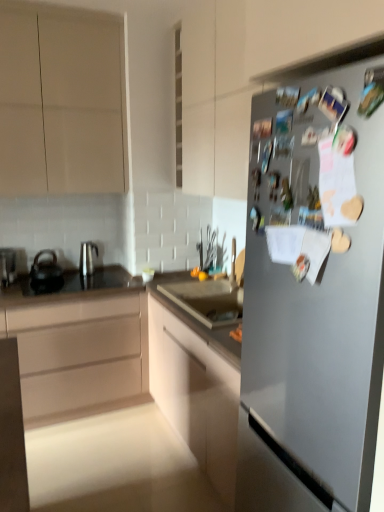
How much space does black matte tea pot at left, acting as the first tea pot starting from the left, occupy vertically?

black matte tea pot at left, acting as the first tea pot starting from the left, is 8.74 inches tall.

Describe the element at coordinates (60, 102) in the screenshot. I see `matte beige cabinet at upper left, positioned as the 1th cabinetry in top-to-bottom order` at that location.

Identify the location of satin silver kettle at left, which ranks as the second tea pot in left-to-right order. Image resolution: width=384 pixels, height=512 pixels. (87, 258).

Identify the location of matte white cabinet at center, the 1th cabinetry from the bottom. [x=126, y=362].

Where is `black matte tea pot at left, acting as the first tea pot starting from the left`? Image resolution: width=384 pixels, height=512 pixels. black matte tea pot at left, acting as the first tea pot starting from the left is located at coordinates (46, 273).

Does satin silver fridge at right appear on the right side of matte beige cabinet at upper left, which is the 3th cabinetry from bottom to top?

Yes.

In the scene shown: From the image's perspective, is satin silver fridge at right on top of matte beige cabinet at upper left, positioned as the 1th cabinetry in top-to-bottom order?

No, from the image's perspective, satin silver fridge at right is not on top of matte beige cabinet at upper left, positioned as the 1th cabinetry in top-to-bottom order.

Is satin silver fridge at right directly adjacent to matte beige cabinet at upper left, which is the 3th cabinetry from bottom to top?

There is a gap between satin silver fridge at right and matte beige cabinet at upper left, which is the 3th cabinetry from bottom to top.

Which is less distant, (351, 223) or (69, 109)?

The point (351, 223) is closer.

Considering their positions, is matte white cabinet at center, the third cabinetry positioned from the top, located in front of or behind metallic silver kettle at left?

Visually, matte white cabinet at center, the third cabinetry positioned from the top, is located in front of metallic silver kettle at left.

Which object is positioned more to the left, matte white cabinet at center, the third cabinetry positioned from the top, or metallic silver kettle at left?

metallic silver kettle at left.

Which of these two, matte white cabinet at center, the third cabinetry positioned from the top, or metallic silver kettle at left, is smaller?

Smaller between the two is metallic silver kettle at left.

In the image, is matte beige cabinet at upper left, which is the 3th cabinetry from bottom to top, on the left side or the right side of black matte tea pot at left, acting as the 2th tea pot starting from the right?

matte beige cabinet at upper left, which is the 3th cabinetry from bottom to top, is to the right of black matte tea pot at left, acting as the 2th tea pot starting from the right.

From the image's perspective, is matte beige cabinet at upper left, positioned as the 1th cabinetry in top-to-bottom order, above black matte tea pot at left, acting as the first tea pot starting from the left?

Indeed, from the image's perspective, matte beige cabinet at upper left, positioned as the 1th cabinetry in top-to-bottom order, is shown above black matte tea pot at left, acting as the first tea pot starting from the left.

Considering the relative sizes of matte beige cabinet at upper left, which is the 3th cabinetry from bottom to top, and black matte tea pot at left, acting as the first tea pot starting from the left, in the image provided, is matte beige cabinet at upper left, which is the 3th cabinetry from bottom to top, wider than black matte tea pot at left, acting as the first tea pot starting from the left,?

Correct, the width of matte beige cabinet at upper left, which is the 3th cabinetry from bottom to top, exceeds that of black matte tea pot at left, acting as the first tea pot starting from the left.

Which point is more distant from viewer, (7, 285) or (88, 242)?

The point (88, 242) is farther.

From a real-world perspective, relative to satin silver kettle at left, which is counted as the 1th tea pot, starting from the right, is metallic silver kettle at left vertically above or below?

In terms of real-world spatial position, metallic silver kettle at left is below satin silver kettle at left, which is counted as the 1th tea pot, starting from the right.

Which tea pot is the 2nd one when counting from the right side of the metallic silver kettle at left? Please provide its 2D coordinates.

[(87, 258)]

Considering the sizes of objects metallic silver kettle at left and satin silver kettle at left, which is counted as the 1th tea pot, starting from the right, in the image provided, who is taller, metallic silver kettle at left or satin silver kettle at left, which is counted as the 1th tea pot, starting from the right,?

satin silver kettle at left, which is counted as the 1th tea pot, starting from the right, is taller.

Does black glass countertop at center turn towards metallic silver kettle at left?

No, black glass countertop at center does not turn towards metallic silver kettle at left.

From the image's perspective, is black glass countertop at center located beneath metallic silver kettle at left?

Correct, black glass countertop at center appears lower than metallic silver kettle at left in the image.

In the scene shown: Is black glass countertop at center smaller than metallic silver kettle at left?

Actually, black glass countertop at center might be larger than metallic silver kettle at left.

Identify the location of countertop that is in front of the metallic silver kettle at left. The width and height of the screenshot is (384, 512). (72, 286).

From the image's perspective, is matte beige cabinet at upper left, which is the 3th cabinetry from bottom to top, beneath metallic silver kettle at left?

No, from the image's perspective, matte beige cabinet at upper left, which is the 3th cabinetry from bottom to top, is not beneath metallic silver kettle at left.

Considering the points (16, 28) and (5, 258), which point is behind, point (16, 28) or point (5, 258)?

The point (5, 258) is more distant.

Considering the relative sizes of matte beige cabinet at upper left, which is the 3th cabinetry from bottom to top, and metallic silver kettle at left in the image provided, is matte beige cabinet at upper left, which is the 3th cabinetry from bottom to top, smaller than metallic silver kettle at left?

Actually, matte beige cabinet at upper left, which is the 3th cabinetry from bottom to top, might be larger than metallic silver kettle at left.

Considering the sizes of objects matte beige cabinet at upper left, positioned as the 1th cabinetry in top-to-bottom order, and metallic silver kettle at left in the image provided, who is taller, matte beige cabinet at upper left, positioned as the 1th cabinetry in top-to-bottom order, or metallic silver kettle at left?

matte beige cabinet at upper left, positioned as the 1th cabinetry in top-to-bottom order.

Is satin silver fridge at right wider or thinner than matte white cabinet at center, the third cabinetry positioned from the top?

In the image, satin silver fridge at right appears to be more narrow than matte white cabinet at center, the third cabinetry positioned from the top.

What's the angular difference between satin silver fridge at right and matte white cabinet at center, the 1th cabinetry from the bottom,'s facing directions?

The angle between the facing direction of satin silver fridge at right and the facing direction of matte white cabinet at center, the 1th cabinetry from the bottom, is 90 degrees.

From the image's perspective, which object appears higher, satin silver fridge at right or matte white cabinet at center, the 1th cabinetry from the bottom?

satin silver fridge at right.

Between satin silver fridge at right and matte white cabinet at center, the 1th cabinetry from the bottom, which one is positioned in front?

satin silver fridge at right is in front.

From the satin silver fridge at right, count the 3rd cabinetry to the left and point to it. Please provide its 2D coordinates.

[(60, 102)]

Identify the location of kitchen appliance behind the matte white cabinet at center, the 1th cabinetry from the bottom. (7, 267).

Consider the image. Based on their spatial positions, is matte beige cabinet at upper left, which is the 3th cabinetry from bottom to top, or black glass countertop at center closer to satin silver kettle at left, which is counted as the 1th tea pot, starting from the right?

Based on the image, black glass countertop at center appears to be nearer to satin silver kettle at left, which is counted as the 1th tea pot, starting from the right.

Looking at the image, which one is located closer to matte white cabinet at center, the third cabinetry positioned from the top, metallic silver kettle at left or satin silver kettle at left, which ranks as the second tea pot in left-to-right order?

satin silver kettle at left, which ranks as the second tea pot in left-to-right order, is closer to matte white cabinet at center, the third cabinetry positioned from the top.

Looking at the image, which one is located further to matte beige cabinet at left, marked as the 2th cabinetry in a top-to-bottom arrangement, black glass countertop at center or metallic silver kettle at left?

Among the two, metallic silver kettle at left is located further to matte beige cabinet at left, marked as the 2th cabinetry in a top-to-bottom arrangement.

Based on their spatial positions, is satin silver fridge at right or metallic silver kettle at left closer to matte beige cabinet at left, marked as the 2th cabinetry in a top-to-bottom arrangement?

Among the two, metallic silver kettle at left is located nearer to matte beige cabinet at left, marked as the 2th cabinetry in a top-to-bottom arrangement.

Estimate the real-world distances between objects in this image. Which object is further from matte white cabinet at center, the third cabinetry positioned from the top, satin silver fridge at right or metallic silver kettle at left?

Based on the image, satin silver fridge at right appears to be further to matte white cabinet at center, the third cabinetry positioned from the top.

Estimate the real-world distances between objects in this image. Which object is closer to black glass countertop at center, metallic silver kettle at left or matte white cabinet at center, the third cabinetry positioned from the top?

metallic silver kettle at left.

Estimate the real-world distances between objects in this image. Which object is further from matte beige cabinet at left, marked as the 2th cabinetry in a top-to-bottom arrangement, black matte tea pot at left, acting as the first tea pot starting from the left, or metallic silver kettle at left?

Based on the image, metallic silver kettle at left appears to be further to matte beige cabinet at left, marked as the 2th cabinetry in a top-to-bottom arrangement.

Based on their spatial positions, is matte beige cabinet at upper left, which is the 3th cabinetry from bottom to top, or black glass countertop at center further from black matte tea pot at left, acting as the 2th tea pot starting from the right?

Based on the image, matte beige cabinet at upper left, which is the 3th cabinetry from bottom to top, appears to be further to black matte tea pot at left, acting as the 2th tea pot starting from the right.

Where is `countertop between satin silver fridge at right and satin silver kettle at left, which ranks as the second tea pot in left-to-right order, in the front-back direction`? countertop between satin silver fridge at right and satin silver kettle at left, which ranks as the second tea pot in left-to-right order, in the front-back direction is located at coordinates (72, 286).

The height and width of the screenshot is (512, 384). I want to click on countertop between matte beige cabinet at upper left, positioned as the 1th cabinetry in top-to-bottom order, and matte white cabinet at center, the third cabinetry positioned from the top, in the up-down direction, so click(x=72, y=286).

Where is `countertop between matte white cabinet at center, the third cabinetry positioned from the top, and satin silver kettle at left, which is counted as the 1th tea pot, starting from the right, along the z-axis`? Image resolution: width=384 pixels, height=512 pixels. countertop between matte white cabinet at center, the third cabinetry positioned from the top, and satin silver kettle at left, which is counted as the 1th tea pot, starting from the right, along the z-axis is located at coordinates (72, 286).

Find the location of a particular element. countertop between satin silver fridge at right and metallic silver kettle at left along the z-axis is located at coordinates (72, 286).